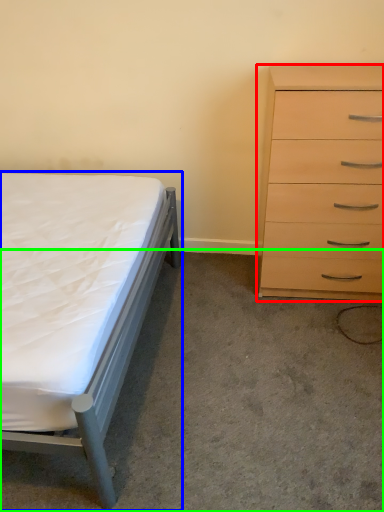
Question: Considering the real-world distances, which object is farthest from chest of drawers (highlighted by a red box)? bed (highlighted by a blue box) or concrete (highlighted by a green box)?

Choices:
 (A) bed
 (B) concrete

Answer: (A)